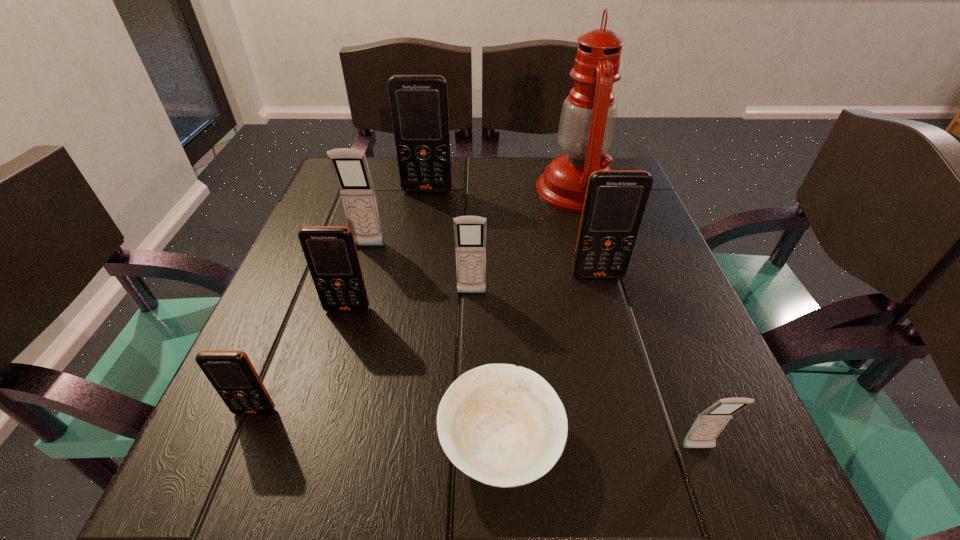
This screenshot has height=540, width=960. Identify the location of unoccupied position between the tallest object and the farthest cellular telephone. (502, 191).

Find the location of a particular element. This screenshot has height=540, width=960. free area in between the shortest object and the third biggest orange cellular telephone is located at coordinates (424, 377).

At what (x,y) coordinates should I click in order to perform the action: click on empty space that is in between the beige bowl and the nearest orange cellular telephone. Please return your answer as a coordinate pair (x, y). Looking at the image, I should click on (378, 428).

The height and width of the screenshot is (540, 960). Find the location of `free spot between the rightmost gray cellular telephone and the third nearest orange cellular telephone`. free spot between the rightmost gray cellular telephone and the third nearest orange cellular telephone is located at coordinates (648, 362).

Locate which object is the closest to the third farthest cellular telephone. Please provide its 2D coordinates. Your answer should be formatted as a tuple, i.e. [(x, y)], where the tuple contains the x and y coordinates of a point satisfying the conditions above.

[(470, 231)]

Identify which object is the fourth nearest to the oil lamp. Please provide its 2D coordinates. Your answer should be formatted as a tuple, i.e. [(x, y)], where the tuple contains the x and y coordinates of a point satisfying the conditions above.

[(350, 166)]

Identify which cellular telephone is the fifth nearest to the oil lamp. Please provide its 2D coordinates. Your answer should be formatted as a tuple, i.e. [(x, y)], where the tuple contains the x and y coordinates of a point satisfying the conditions above.

[(330, 251)]

Find the location of `the closest cellular telephone relative to the smallest orange cellular telephone`. the closest cellular telephone relative to the smallest orange cellular telephone is located at coordinates (330, 251).

Point out which orange cellular telephone is positioned as the fourth nearest to the second nearest gray cellular telephone. Please provide its 2D coordinates. Your answer should be formatted as a tuple, i.e. [(x, y)], where the tuple contains the x and y coordinates of a point satisfying the conditions above.

[(231, 373)]

Where is `orange cellular telephone that is the second closest one to the smallest orange cellular telephone`? The width and height of the screenshot is (960, 540). orange cellular telephone that is the second closest one to the smallest orange cellular telephone is located at coordinates (615, 201).